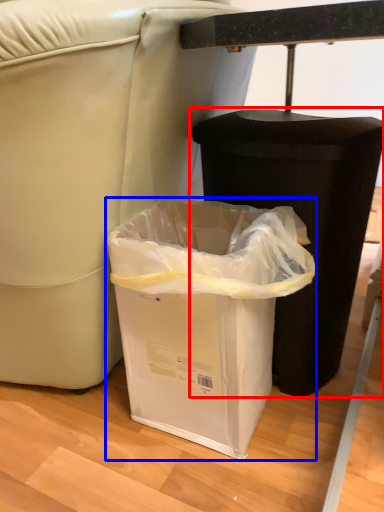
Question: Which object is further to the camera taking this photo, waste container (highlighted by a red box) or waste container (highlighted by a blue box)?

Choices:
 (A) waste container
 (B) waste container

Answer: (A)